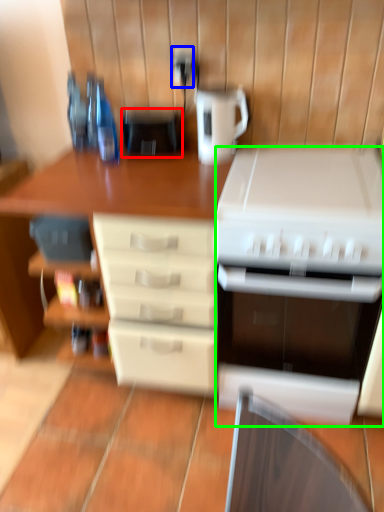
Question: Which is nearer to the appliance (highlighted by a red box)? electric outlet (highlighted by a blue box) or kitchen appliance (highlighted by a green box).

Choices:
 (A) electric outlet
 (B) kitchen appliance

Answer: (A)